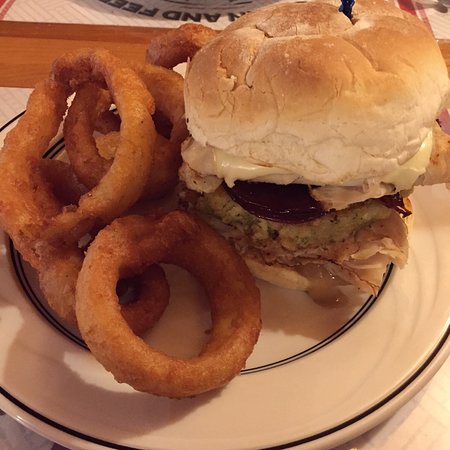
Where is `table beneath plate`? The image size is (450, 450). table beneath plate is located at coordinates pos(410,425).